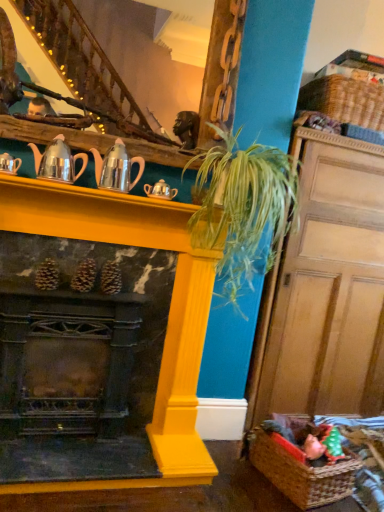
Image resolution: width=384 pixels, height=512 pixels. Identify the location of empty space that is ontop of brown woven basket at lower right, which is the 2th basket in top-to-bottom order (from a real-world perspective). (312, 446).